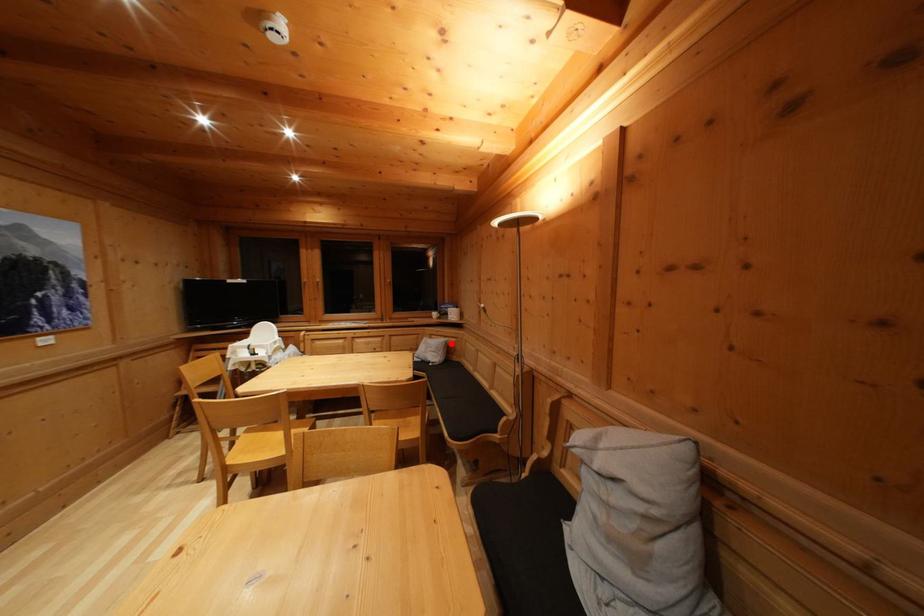
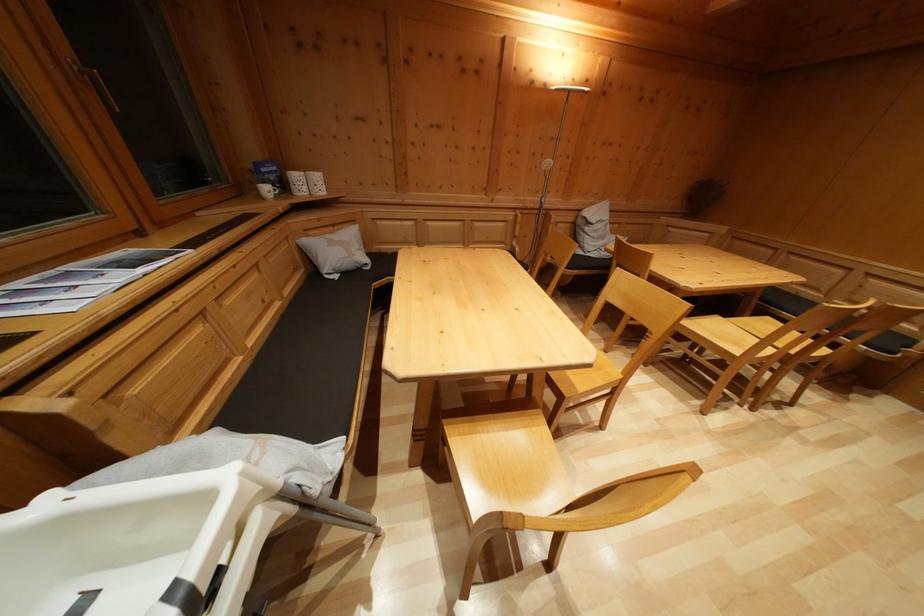
In the second image, find the point that corresponds to the highlighted location in the first image.

(338, 233)